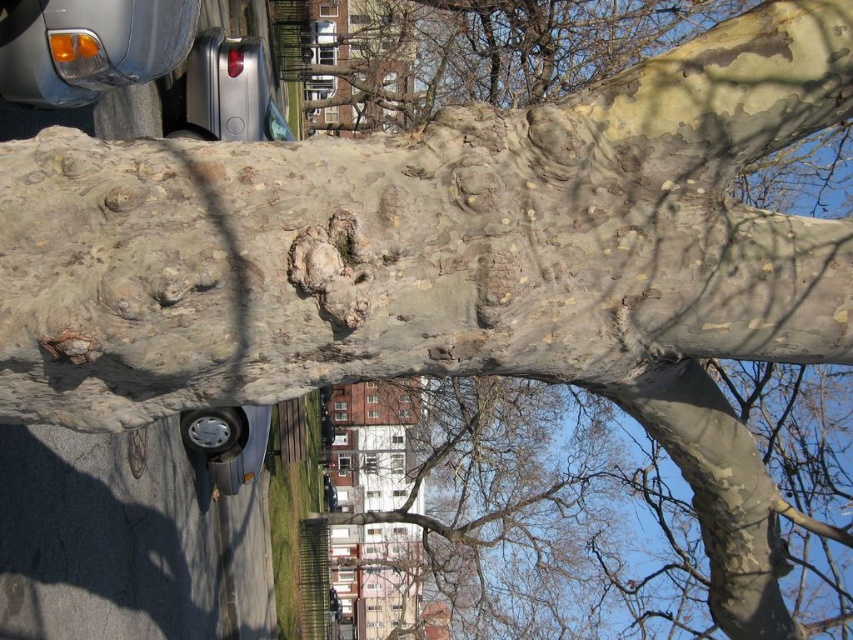
You are a pedestrian standing on the sidewalk looking at the tree trunk. You notice a metallic gray headlight at upper left and a shiny silver hubcap at lower center. Which object is positioned higher up in the image?

The metallic gray headlight at upper left is positioned higher up in the image than the shiny silver hubcap at lower center.

You are a painter setting up your easel to paint the scene. You want to focus on the leathery bark tree trunk at upper center and the shiny silver hubcap at lower center. Which object should you choose if you want to paint the larger subject?

You should choose the leathery bark tree trunk at upper center because it is larger in size than the shiny silver hubcap at lower center.